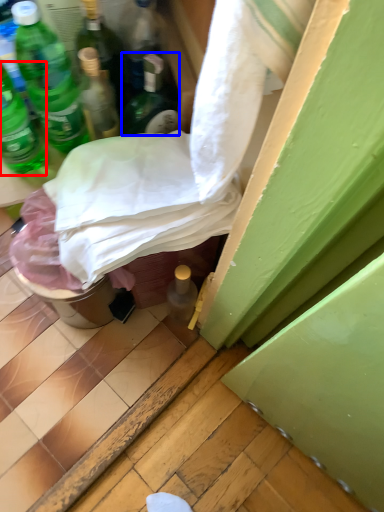
Question: Which object appears closest to the camera in this image, bottle (highlighted by a red box) or bottle (highlighted by a blue box)?

Choices:
 (A) bottle
 (B) bottle

Answer: (A)